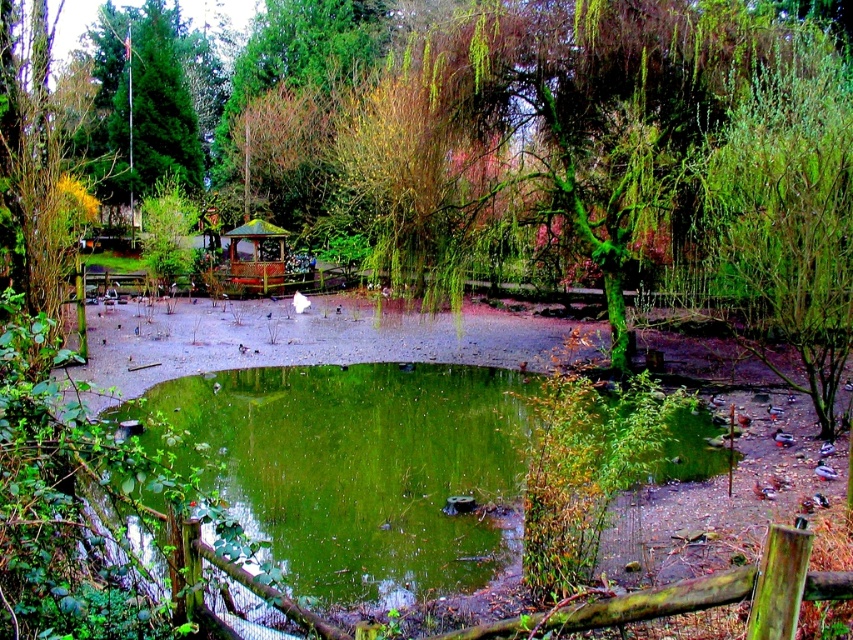
You are standing at the edge of the pond and notice a point marked at coordinates [352,468]. Based on the scene description, what is located at that point?

The point at coordinates [352,468] indicates the green algae covered pond at center.

You are a bird flying over the pond and want to land on the wooden gazebo at center. Can you land there without touching the green leafy tree at center?

The green leafy tree at center is positioned over the wooden gazebo at center, so the tree might block your landing path. You might need to find another spot to land safely.